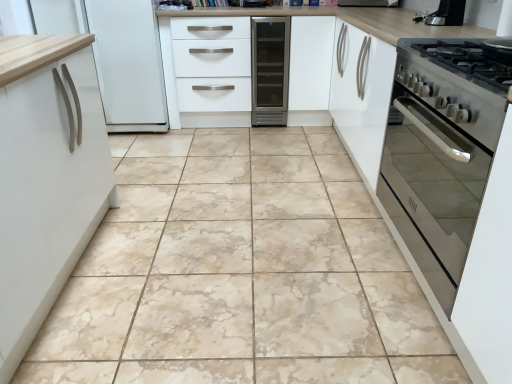
Question: Can you confirm if stainless steel oven at right is positioned to the left of satin black coffee machine at upper right?

Choices:
 (A) yes
 (B) no

Answer: (A)

Question: From a real-world perspective, is stainless steel oven at right physically below satin black coffee machine at upper right?

Choices:
 (A) yes
 (B) no

Answer: (A)

Question: Is stainless steel oven at right not near satin black coffee machine at upper right?

Choices:
 (A) yes
 (B) no

Answer: (B)

Question: From a real-world perspective, does stainless steel oven at right stand above satin black coffee machine at upper right?

Choices:
 (A) no
 (B) yes

Answer: (A)

Question: Is stainless steel oven at right facing towards satin black coffee machine at upper right?

Choices:
 (A) no
 (B) yes

Answer: (A)

Question: Relative to white matte drawer at center, is satin black coffee machine at upper right in front or behind?

Choices:
 (A) front
 (B) behind

Answer: (A)

Question: Considering the positions of satin black coffee machine at upper right and white matte drawer at center in the image, is satin black coffee machine at upper right taller or shorter than white matte drawer at center?

Choices:
 (A) tall
 (B) short

Answer: (B)

Question: In the image, is satin black coffee machine at upper right on the left side or the right side of white matte drawer at center?

Choices:
 (A) right
 (B) left

Answer: (A)

Question: Is satin black coffee machine at upper right spatially inside white matte drawer at center, or outside of it?

Choices:
 (A) outside
 (B) inside

Answer: (A)

Question: Would you say marble tile at center is inside or outside satin black coffee machine at upper right?

Choices:
 (A) outside
 (B) inside

Answer: (A)

Question: From their relative heights in the image, would you say marble tile at center is taller or shorter than satin black coffee machine at upper right?

Choices:
 (A) tall
 (B) short

Answer: (B)

Question: Is marble tile at center bigger or smaller than satin black coffee machine at upper right?

Choices:
 (A) big
 (B) small

Answer: (A)

Question: From the image's perspective, is marble tile at center above or below satin black coffee machine at upper right?

Choices:
 (A) below
 (B) above

Answer: (A)

Question: From a real-world perspective, is satin black coffee machine at upper right positioned above or below satin silver wine cooler at center?

Choices:
 (A) above
 (B) below

Answer: (A)

Question: Is satin black coffee machine at upper right taller or shorter than satin silver wine cooler at center?

Choices:
 (A) short
 (B) tall

Answer: (A)